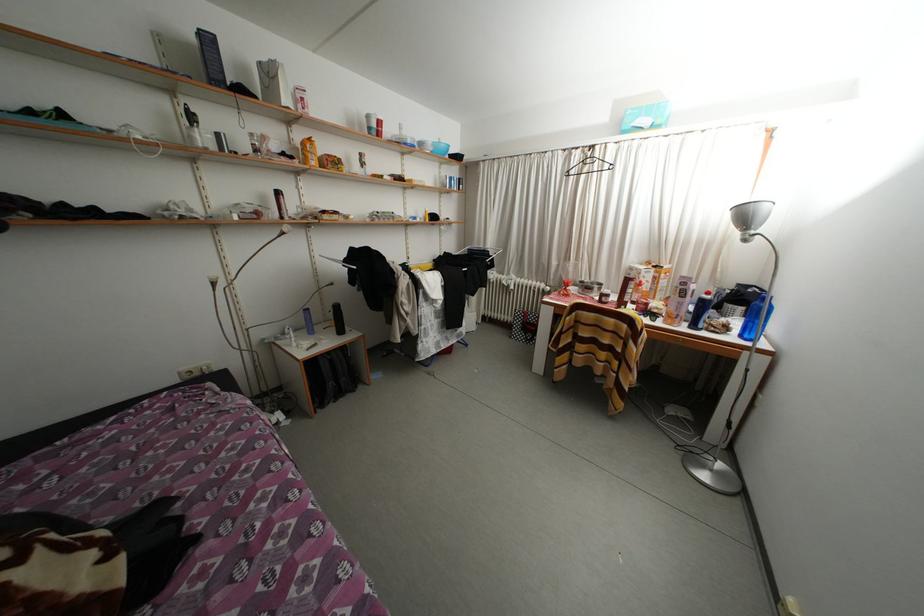
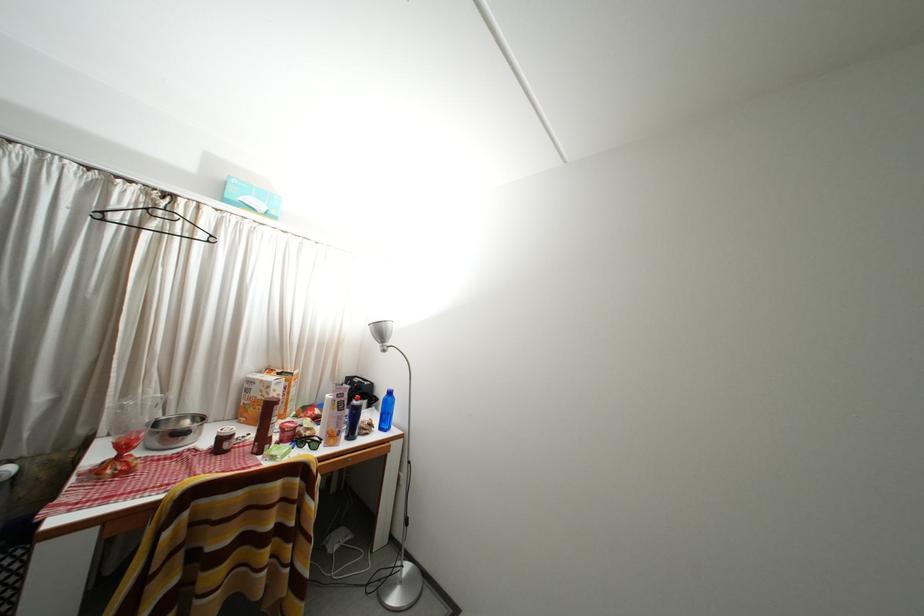
In the second image, find the point that corresponds to [663,315] in the first image.

(315, 439)